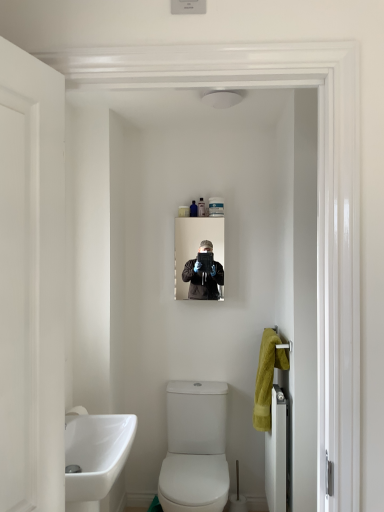
Locate an element on the screen. This screenshot has height=512, width=384. white glossy sink at lower left is located at coordinates (95, 457).

Identify the location of matte black mirror at center. The width and height of the screenshot is (384, 512). (195, 245).

Where is `clear plastic container at upper center, the 4th toiletry from the left`? This screenshot has width=384, height=512. clear plastic container at upper center, the 4th toiletry from the left is located at coordinates (216, 207).

Image resolution: width=384 pixels, height=512 pixels. What do you see at coordinates (183, 211) in the screenshot? I see `white plastic container at upper center, the 1th toiletry from the left` at bounding box center [183, 211].

The width and height of the screenshot is (384, 512). Describe the element at coordinates (201, 207) in the screenshot. I see `translucent plastic container at upper center, the third toiletry when ordered from left to right` at that location.

At what (x,y) coordinates should I click in order to perform the action: click on white glossy sink at lower left. Please return your answer as a coordinate pair (x, y). Looking at the image, I should click on (95, 457).

Between translucent plastic container at upper center, placed as the second toiletry when sorted from right to left, and white glossy sink at lower left, which one has smaller width?

translucent plastic container at upper center, placed as the second toiletry when sorted from right to left, is thinner.

Is point (198, 206) positioned before point (126, 426)?

That is False.

Considering the relative sizes of translucent plastic container at upper center, placed as the second toiletry when sorted from right to left, and white glossy sink at lower left in the image provided, is translucent plastic container at upper center, placed as the second toiletry when sorted from right to left, bigger than white glossy sink at lower left?

Incorrect, translucent plastic container at upper center, placed as the second toiletry when sorted from right to left, is not larger than white glossy sink at lower left.

What's the angular difference between translucent plastic container at upper center, placed as the second toiletry when sorted from right to left, and white glossy sink at lower left's facing directions?

The angle between the facing direction of translucent plastic container at upper center, placed as the second toiletry when sorted from right to left, and the facing direction of white glossy sink at lower left is 89.8 degrees.

Is white glossy towel rack at right, arranged as the 1th door when viewed from the back, positioned in front of translucent plastic bottle at upper center, which ranks as the third toiletry in right-to-left order?

Yes, white glossy towel rack at right, arranged as the 1th door when viewed from the back, is closer to the viewer.

Does point (282, 444) lie in front of point (191, 210)?

Yes, it is.

How distant is white glossy towel rack at right, the first door when ordered from bottom to top, from translucent plastic bottle at upper center, the 2th toiletry positioned from the left?

white glossy towel rack at right, the first door when ordered from bottom to top, and translucent plastic bottle at upper center, the 2th toiletry positioned from the left, are 1.32 meters apart.

From the picture: Who is bigger, white glossy towel rack at right, the second door when ordered from front to back, or translucent plastic bottle at upper center, which ranks as the third toiletry in right-to-left order?

With larger size is white glossy towel rack at right, the second door when ordered from front to back.

Looking at this image, can you see matte black mirror at center touching translucent plastic container at upper center, the third toiletry when ordered from left to right?

No, matte black mirror at center is not in contact with translucent plastic container at upper center, the third toiletry when ordered from left to right.

At what (x,y) coordinates should I click in order to perform the action: click on mirror on the left of translucent plastic container at upper center, placed as the second toiletry when sorted from right to left. Please return your answer as a coordinate pair (x, y). The image size is (384, 512). Looking at the image, I should click on (195, 245).

From a real-world perspective, which object stands above the other?

From a 3D spatial view, translucent plastic container at upper center, the third toiletry when ordered from left to right, is above.

Which is more to the left, matte black mirror at center or translucent plastic container at upper center, the third toiletry when ordered from left to right?

From the viewer's perspective, matte black mirror at center appears more on the left side.

From a real-world perspective, which object stands above the other?

From a 3D spatial view, translucent plastic container at upper center, the third toiletry when ordered from left to right, is above.

Is translucent plastic container at upper center, the third toiletry when ordered from left to right, next to translucent plastic bottle at upper center, the 2th toiletry positioned from the left, and touching it?

Indeed, translucent plastic container at upper center, the third toiletry when ordered from left to right, and translucent plastic bottle at upper center, the 2th toiletry positioned from the left, are beside each other and touching.

You are a GUI agent. You are given a task and a screenshot of the screen. Output one action in this format:
    pyautogui.click(x=<x>, y=<y>)
    Task: Click on the 1st toiletry to the right of the translucent plastic bottle at upper center, which ranks as the third toiletry in right-to-left order, starting your count from the anchor
    The width and height of the screenshot is (384, 512).
    Given the screenshot: What is the action you would take?
    pyautogui.click(x=201, y=207)

Is translucent plastic container at upper center, the third toiletry when ordered from left to right, oriented away from translucent plastic bottle at upper center, which ranks as the third toiletry in right-to-left order?

No.

Does point (202, 215) lie in front of point (183, 291)?

Yes, it is.

In terms of width, does translucent plastic container at upper center, the third toiletry when ordered from left to right, look wider or thinner when compared to matte black mirror at center?

Considering their sizes, translucent plastic container at upper center, the third toiletry when ordered from left to right, looks slimmer than matte black mirror at center.

Is translucent plastic container at upper center, the third toiletry when ordered from left to right, shorter than matte black mirror at center?

Yes, translucent plastic container at upper center, the third toiletry when ordered from left to right, is shorter than matte black mirror at center.

Considering their positions, is translucent plastic container at upper center, placed as the second toiletry when sorted from right to left, located in front of or behind matte black mirror at center?

translucent plastic container at upper center, placed as the second toiletry when sorted from right to left, is behind matte black mirror at center.

Is white glossy toilet at center thinner than matte black mirror at center?

No, white glossy toilet at center is not thinner than matte black mirror at center.

From the image's perspective, is white glossy toilet at center on matte black mirror at center?

Incorrect, from the image's perspective, white glossy toilet at center is lower than matte black mirror at center.

Which is more to the left, white glossy toilet at center or matte black mirror at center?

white glossy toilet at center is more to the left.

Locate an element on the screen. toilet on the left of matte black mirror at center is located at coordinates (195, 448).

Is point (176, 270) closer or farther from the camera than point (193, 209)?

Point (176, 270) is positioned farther from the camera compared to point (193, 209).

Who is more distant, matte black mirror at center or translucent plastic bottle at upper center, which ranks as the third toiletry in right-to-left order?

translucent plastic bottle at upper center, which ranks as the third toiletry in right-to-left order, is further from the camera.

From the image's perspective, count 3rd toiletrys upward from the matte black mirror at center and point to it. Please provide its 2D coordinates.

[(193, 209)]

Measure the distance from matte black mirror at center to translucent plastic bottle at upper center, the 2th toiletry positioned from the left.

matte black mirror at center and translucent plastic bottle at upper center, the 2th toiletry positioned from the left, are 8.04 inches apart from each other.

From the image's perspective, count 4th toiletrys upward from the white glossy sink at lower left and point to it. Please provide its 2D coordinates.

[(201, 207)]

From a real-world perspective, count 3rd toiletrys upward from the white glossy towel rack at right, the second door when ordered from left to right, and point to it. Please provide its 2D coordinates.

[(193, 209)]

Based on their spatial positions, is matte black mirror at center or white glossy towel rack at right, arranged as the 1th door when viewed from the back, closer to translucent plastic container at upper center, the third toiletry when ordered from left to right?

Based on the image, matte black mirror at center appears to be nearer to translucent plastic container at upper center, the third toiletry when ordered from left to right.

Which object lies further to the anchor point matte black mirror at center, translucent plastic bottle at upper center, the 2th toiletry positioned from the left, or yellow soft towel at right?

The object further to matte black mirror at center is yellow soft towel at right.

Considering their positions, is white matte door at left, the 1th door viewed from the front, positioned closer to white glossy towel rack at right, the first door when ordered from bottom to top, than translucent plastic container at upper center, placed as the second toiletry when sorted from right to left?

Based on the image, translucent plastic container at upper center, placed as the second toiletry when sorted from right to left, appears to be nearer to white glossy towel rack at right, the first door when ordered from bottom to top.

Looking at the image, which one is located closer to white glossy toilet at center, white matte door at left, which is the second door in right-to-left order, or white glossy towel rack at right, which appears as the first door when viewed from the right?

white glossy towel rack at right, which appears as the first door when viewed from the right, is closer to white glossy toilet at center.

Considering their positions, is white plastic container at upper center, the 1th toiletry from the left, positioned further to white glossy toilet at center than clear plastic container at upper center, the 4th toiletry from the left?

white plastic container at upper center, the 1th toiletry from the left, lies further to white glossy toilet at center than the other object.

Which object lies further to the anchor point white glossy sink at lower left, white glossy towel rack at right, the second door when ordered from left to right, or translucent plastic container at upper center, placed as the second toiletry when sorted from right to left?

Based on the image, translucent plastic container at upper center, placed as the second toiletry when sorted from right to left, appears to be further to white glossy sink at lower left.

From the image, which object appears to be farther from yellow soft towel at right, clear plastic container at upper center, the 4th toiletry from the left, or translucent plastic bottle at upper center, which ranks as the third toiletry in right-to-left order?

translucent plastic bottle at upper center, which ranks as the third toiletry in right-to-left order.

Based on their spatial positions, is clear plastic container at upper center, placed as the first toiletry when sorted from right to left, or translucent plastic container at upper center, the third toiletry when ordered from left to right, further from white glossy toilet at center?

Based on the image, translucent plastic container at upper center, the third toiletry when ordered from left to right, appears to be further to white glossy toilet at center.

This screenshot has height=512, width=384. Identify the location of sink between translucent plastic container at upper center, placed as the second toiletry when sorted from right to left, and white glossy toilet at center vertically. (95, 457).

The image size is (384, 512). What are the coordinates of `mirror positioned between white glossy sink at lower left and translucent plastic container at upper center, the third toiletry when ordered from left to right, from near to far` in the screenshot? It's located at (195, 245).

I want to click on toilet between white matte door at left, which is the second door in right-to-left order, and matte black mirror at center from front to back, so click(195, 448).

Image resolution: width=384 pixels, height=512 pixels. I want to click on sink between white plastic container at upper center, the fourth toiletry from the right, and white glossy toilet at center vertically, so 95,457.